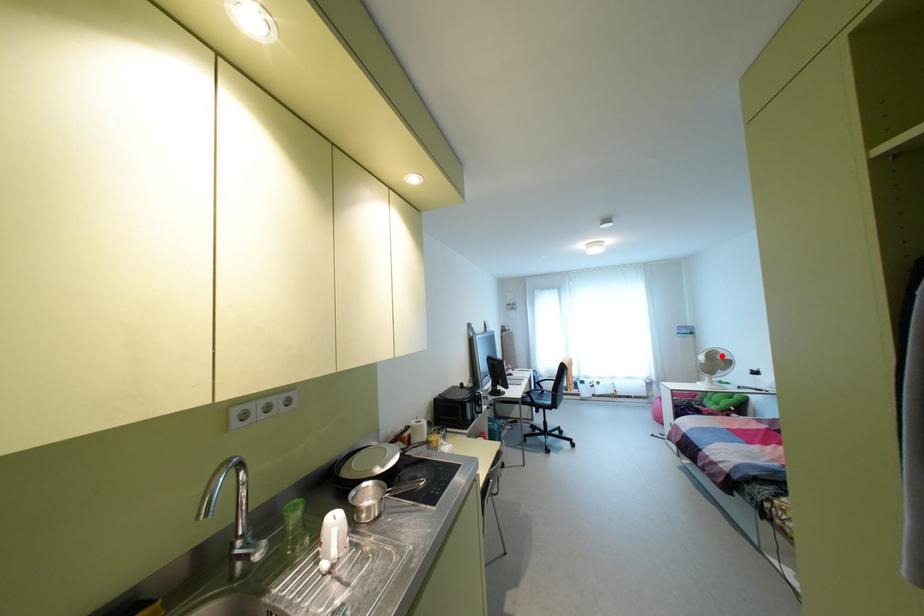
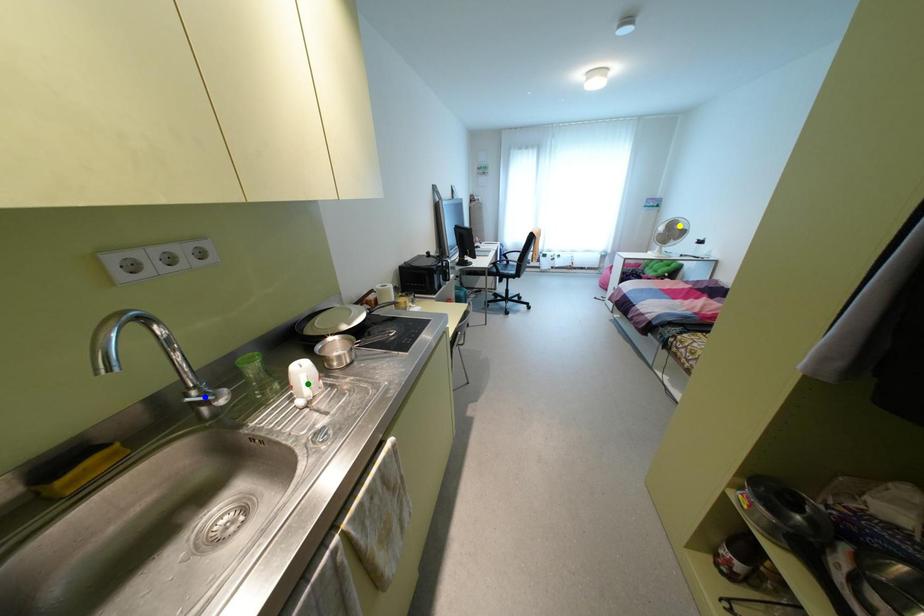
Question: I am providing you with two images of the same scene from different viewpoints. A red point is marked on the first image. You are given multiple points on the second image. Which point in image 2 represents the same 3d spot as the red point in image 1?

Choices:
 (A) yellow point
 (B) green point
 (C) blue point

Answer: (A)